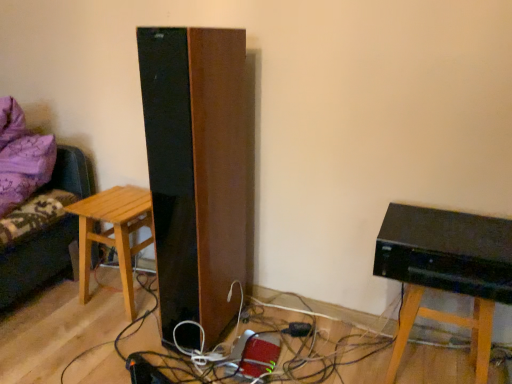
The image size is (512, 384). I want to click on vacant area on the back side of black plastic plug at lower center, so click(x=288, y=313).